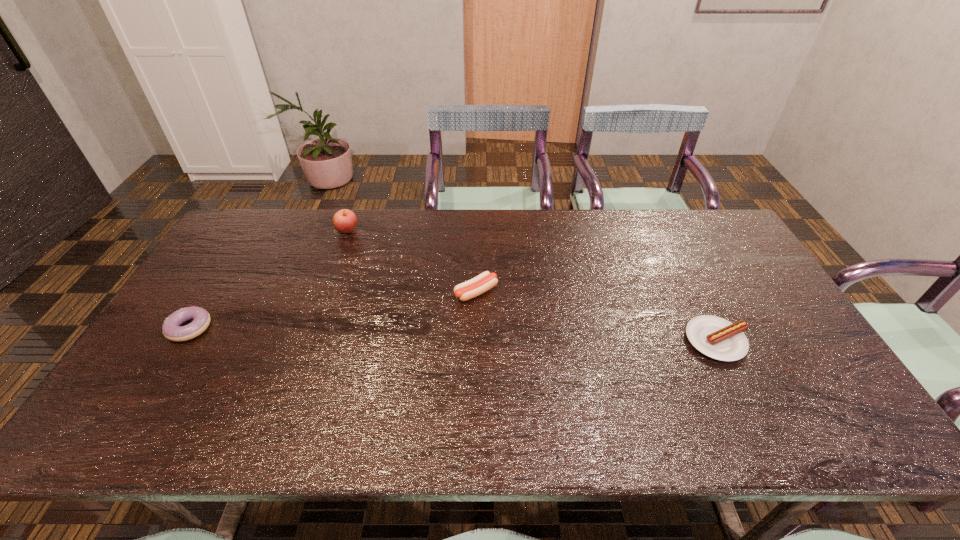
Locate an element on the screen. This screenshot has height=540, width=960. object that stands as the third closest to the farthest object is located at coordinates (715, 337).

Where is `object that ranks as the second closest to the nearer sausage`? Image resolution: width=960 pixels, height=540 pixels. object that ranks as the second closest to the nearer sausage is located at coordinates (344, 221).

This screenshot has width=960, height=540. I want to click on free space that satisfies the following two spatial constraints: 1. on the back side of the doughnut; 2. on the left side of the farther sausage, so click(x=212, y=292).

Locate an element on the screen. free spot that satisfies the following two spatial constraints: 1. on the front side of the left sausage; 2. on the right side of the rightmost object is located at coordinates (475, 341).

Locate an element on the screen. This screenshot has width=960, height=540. blank area in the image that satisfies the following two spatial constraints: 1. on the front side of the rightmost object; 2. on the left side of the tallest object is located at coordinates (307, 341).

Image resolution: width=960 pixels, height=540 pixels. Identify the location of vacant space that satisfies the following two spatial constraints: 1. on the back side of the doughnut; 2. on the left side of the apple. (252, 230).